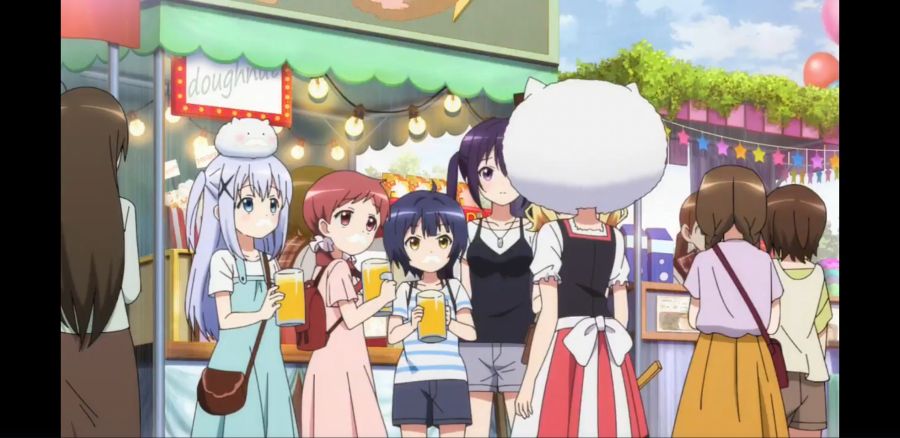
Image resolution: width=900 pixels, height=438 pixels. In order to click on brown wooden handle in this screenshot , I will do `click(650, 375)`.